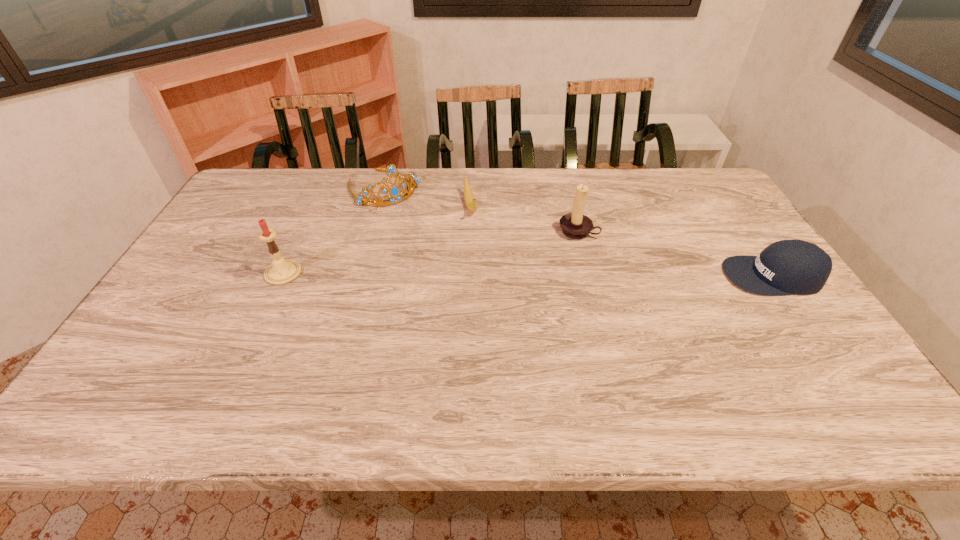
This screenshot has height=540, width=960. I want to click on vacant space located 0.170m on the front-facing side of the rightmost object, so click(662, 276).

At what (x,y) coordinates should I click in order to perform the action: click on vacant space located on the front-facing side of the rightmost object. Please return your answer as a coordinate pair (x, y). This screenshot has height=540, width=960. Looking at the image, I should click on (651, 276).

At what (x,y) coordinates should I click in order to perform the action: click on blank area located 0.280m on the wick of the fourth object from left to right. Please return your answer as a coordinate pair (x, y). Looking at the image, I should click on (526, 299).

You are a GUI agent. You are given a task and a screenshot of the screen. Output one action in this format:
    pyautogui.click(x=<x>, y=<y>)
    Task: Click on the vacant area situated on the wick of the fourth object from left to right
    This screenshot has height=540, width=960.
    Given the screenshot: What is the action you would take?
    pyautogui.click(x=539, y=282)

At what (x,y) coordinates should I click in order to perform the action: click on vacant space located 0.290m on the wick of the fourth object from left to right. Please return your answer as a coordinate pair (x, y). This screenshot has height=540, width=960. Looking at the image, I should click on (525, 301).

Where is `free spot located 0.290m at the stem of the shortest object`? This screenshot has height=540, width=960. free spot located 0.290m at the stem of the shortest object is located at coordinates (492, 288).

The width and height of the screenshot is (960, 540). Identify the location of vacant space located at the stem of the shortest object. (496, 304).

Find the location of `free space located 0.110m at the stem of the shortest object`. free space located 0.110m at the stem of the shortest object is located at coordinates (478, 245).

The image size is (960, 540). What are the coordinates of `free region located 0.360m on the front-facing side of the tiara` in the screenshot? It's located at (454, 268).

You are a GUI agent. You are given a task and a screenshot of the screen. Output one action in this format:
    pyautogui.click(x=<x>, y=<y>)
    Task: Click on the free space located on the front-facing side of the tiara
    The height and width of the screenshot is (540, 960).
    Given the screenshot: What is the action you would take?
    pyautogui.click(x=429, y=239)